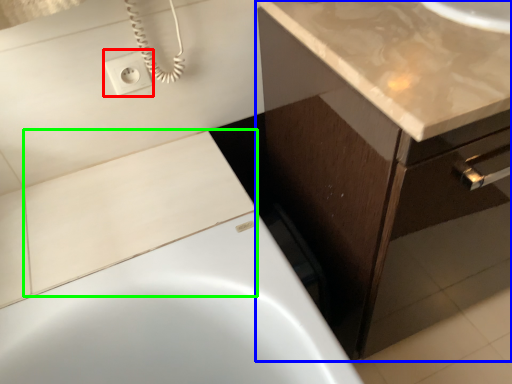
Question: Which is farther away from electric outlet (highlighted by a red box)? bathroom cabinet (highlighted by a blue box) or tile (highlighted by a green box)?

Choices:
 (A) bathroom cabinet
 (B) tile

Answer: (A)